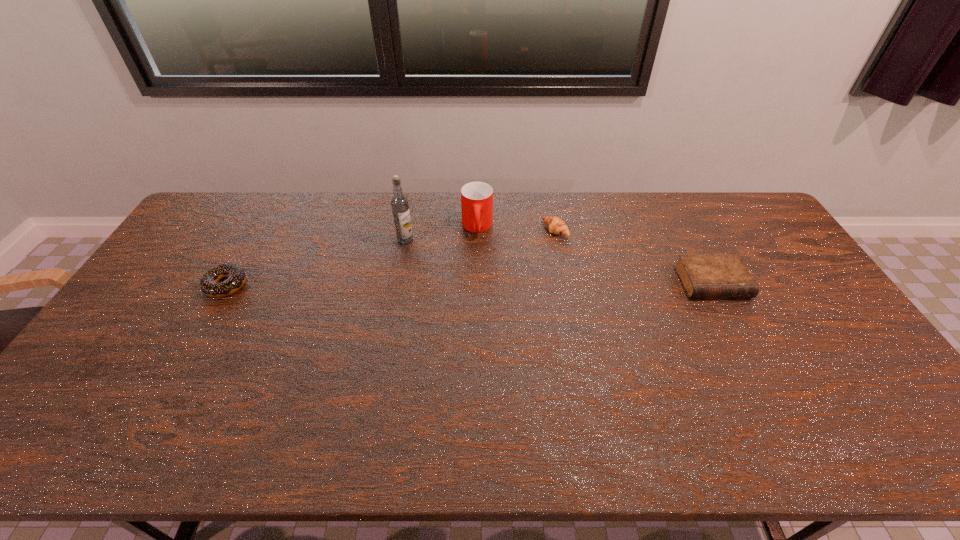
Find the location of `the leftmost object`. the leftmost object is located at coordinates (236, 276).

In order to click on diary in this screenshot , I will do `click(702, 275)`.

Find the location of a particular element. The width and height of the screenshot is (960, 540). vodka is located at coordinates (400, 208).

Find the location of a particular element. The image size is (960, 540). the tallest object is located at coordinates (400, 208).

Locate an element on the screen. This screenshot has width=960, height=540. the second object from right to left is located at coordinates (555, 225).

At what (x,y) coordinates should I click in order to perform the action: click on cup. Please return your answer as a coordinate pair (x, y). This screenshot has width=960, height=540. Looking at the image, I should click on (476, 197).

Where is `the third object from right to left`? the third object from right to left is located at coordinates (476, 197).

Identify the location of vacant region located 0.210m on the front of the leftmost object. (183, 360).

This screenshot has width=960, height=540. Identify the location of free space located 0.260m on the spine side of the diary. (761, 377).

You are a GUI agent. You are given a task and a screenshot of the screen. Output one action in this format:
    pyautogui.click(x=<x>, y=<y>)
    Task: Click on the blank area located 0.200m on the label of the tallest object
    This screenshot has height=540, width=960.
    Given the screenshot: What is the action you would take?
    pyautogui.click(x=407, y=288)